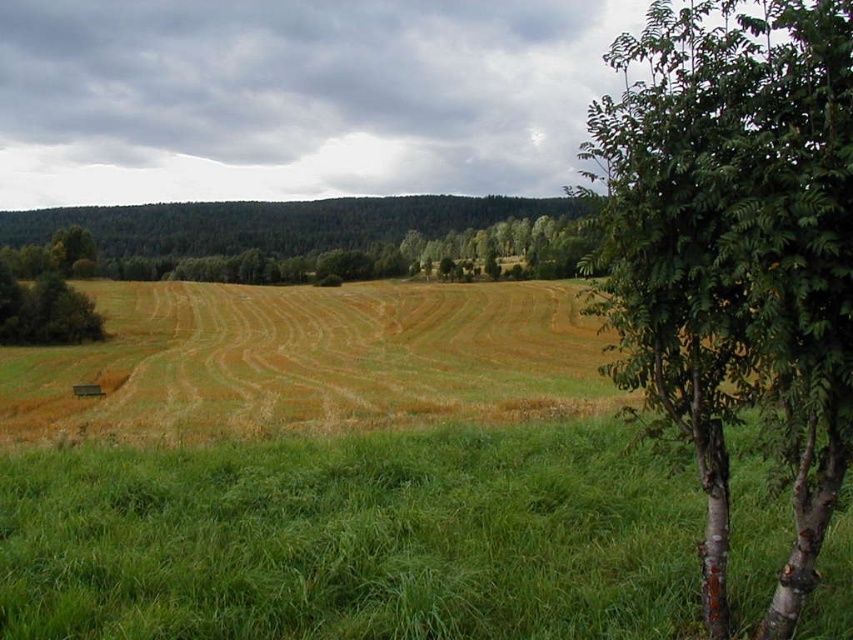
Question: Which of the following is the closest to the observer?

Choices:
 (A) green grassy at lower right
 (B) green leafy tree at left
 (C) green bark birch tree at right

Answer: (C)

Question: Does green grassy at lower right appear over green leafy tree at left?

Choices:
 (A) yes
 (B) no

Answer: (B)

Question: Which of these objects is positioned closest to the green grassy at lower right?

Choices:
 (A) green leafy tree at left
 (B) green bark birch tree at right

Answer: (B)

Question: Is green grassy at lower right smaller than green leafy tree at left?

Choices:
 (A) no
 (B) yes

Answer: (B)

Question: Which object appears closest to the camera in this image?

Choices:
 (A) green leafy tree at left
 (B) green grassy at lower right
 (C) green bark birch tree at right

Answer: (C)

Question: Can you confirm if green bark birch tree at right is thinner than green leafy tree at left?

Choices:
 (A) yes
 (B) no

Answer: (A)